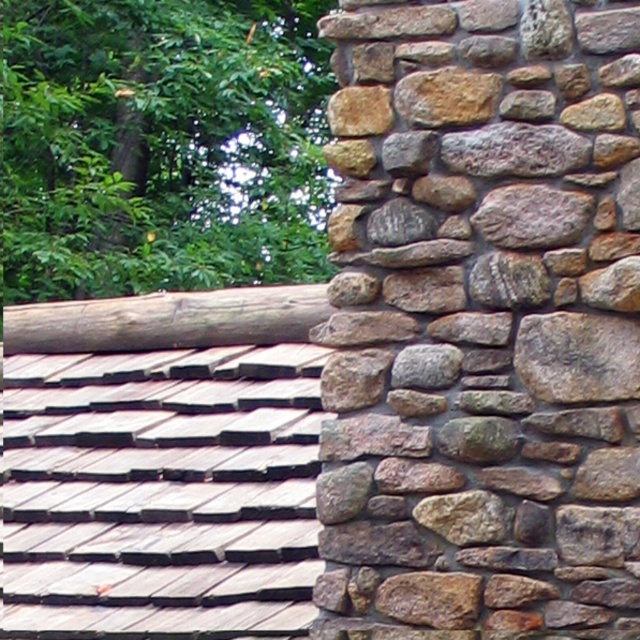
Question: Is natural stone wall at right below brown rough log at upper left?

Choices:
 (A) yes
 (B) no

Answer: (A)

Question: Which point appears farthest from the camera in this image?

Choices:
 (A) (262, 308)
 (B) (598, 464)

Answer: (A)

Question: Can you confirm if natural stone wall at right is positioned above brown rough log at upper left?

Choices:
 (A) no
 (B) yes

Answer: (A)

Question: Observing the image, what is the correct spatial positioning of natural stone wall at right in reference to brown rough log at upper left?

Choices:
 (A) below
 (B) above

Answer: (A)

Question: Which of the following is the farthest from the observer?

Choices:
 (A) natural stone wall at right
 (B) brown rough log at upper left

Answer: (B)